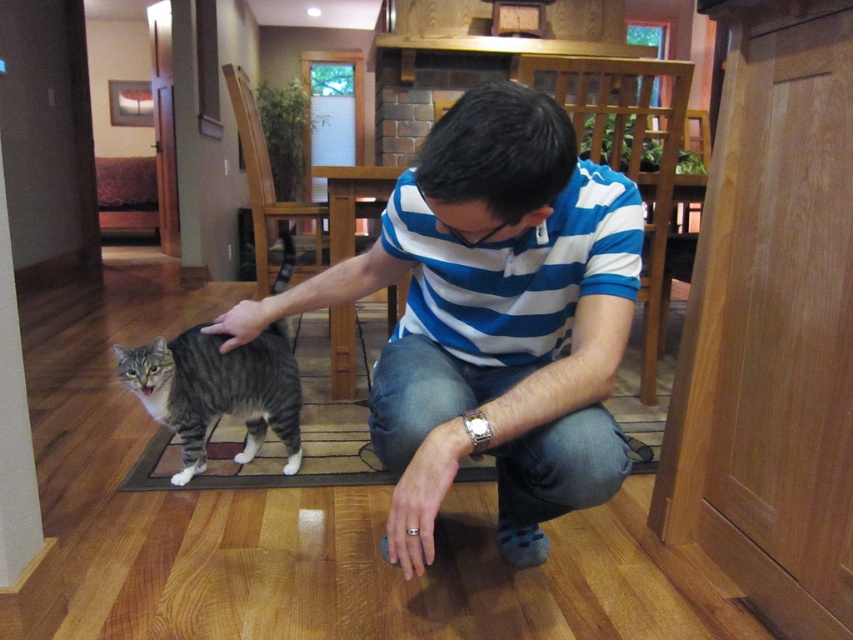
Question: Does blue striped shirt at center have a lesser width compared to striped fur cat at center?

Choices:
 (A) yes
 (B) no

Answer: (B)

Question: Observing the image, what is the correct spatial positioning of blue striped shirt at center in reference to striped fur cat at center?

Choices:
 (A) right
 (B) left

Answer: (A)

Question: Which point appears farthest from the camera in this image?

Choices:
 (A) (544, 484)
 (B) (206, 385)

Answer: (B)

Question: Observing the image, what is the correct spatial positioning of blue striped shirt at center in reference to striped fur cat at center?

Choices:
 (A) right
 (B) left

Answer: (A)